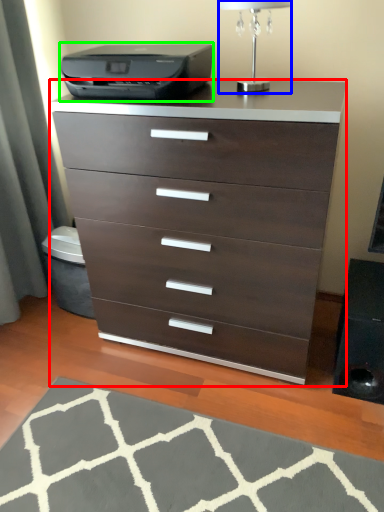
Question: Which object is the closest to the chest of drawers (highlighted by a red box)? Choose among these: table lamp (highlighted by a blue box) or printer (highlighted by a green box).

Choices:
 (A) table lamp
 (B) printer

Answer: (B)